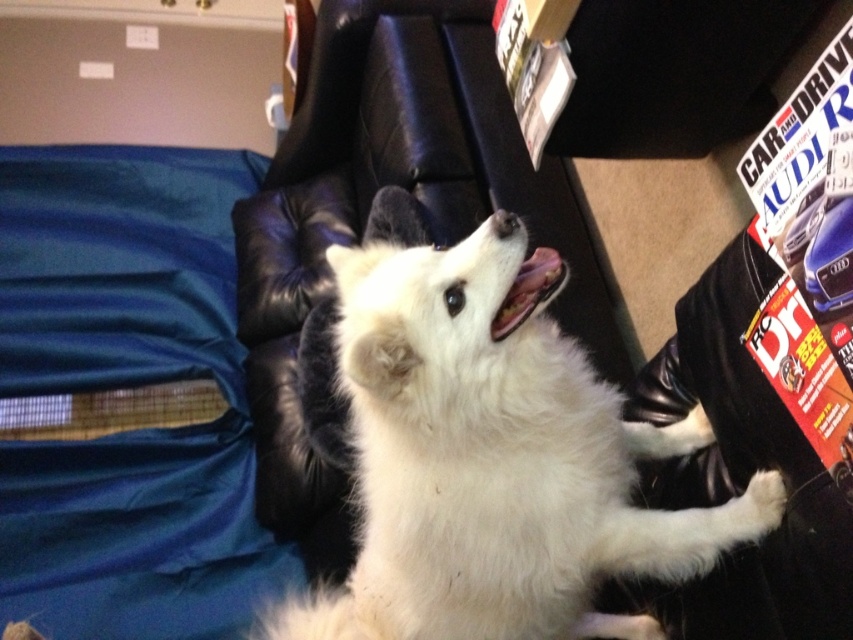
Where is the white fluffy dog at center located in the image?

The white fluffy dog at center is located at point (488, 451) in the image.

You are a photographer setting up a shoot in the living room. You need to position a camera on the floor so it can capture both the white fluffy dog at center and the black leather magazine rack at upper right in the same frame. Based on their positions, will the camera need to be angled upwards or downwards to include both?

The white fluffy dog at center is in front of the black leather magazine rack at upper right, so the camera should be angled upwards to capture both in the same frame.